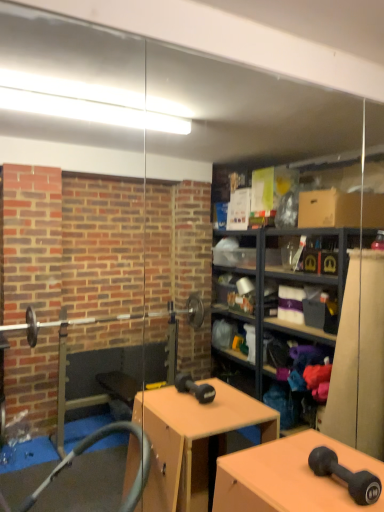
Locate an element on the screen. free space behind matte black dumbbell at lower right is located at coordinates (x=311, y=450).